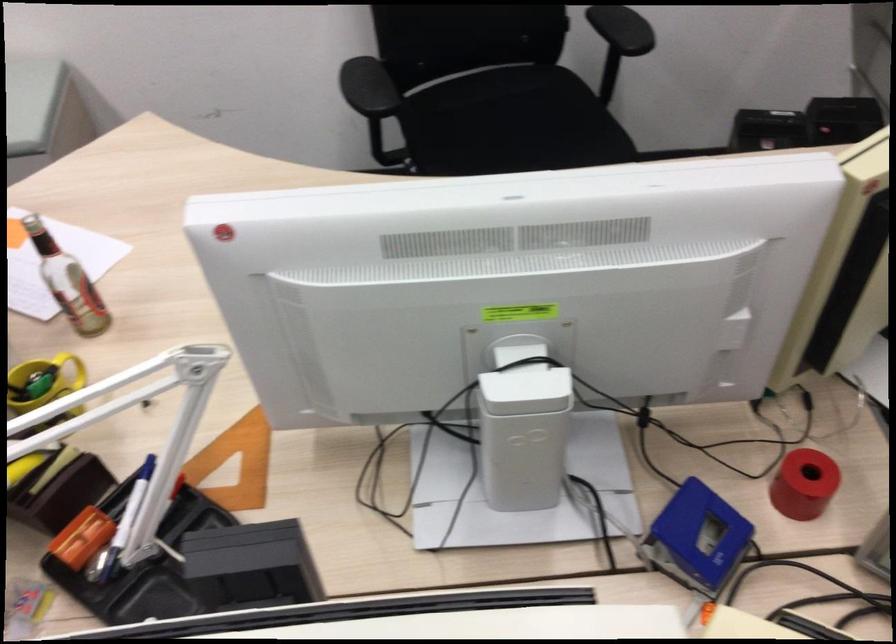
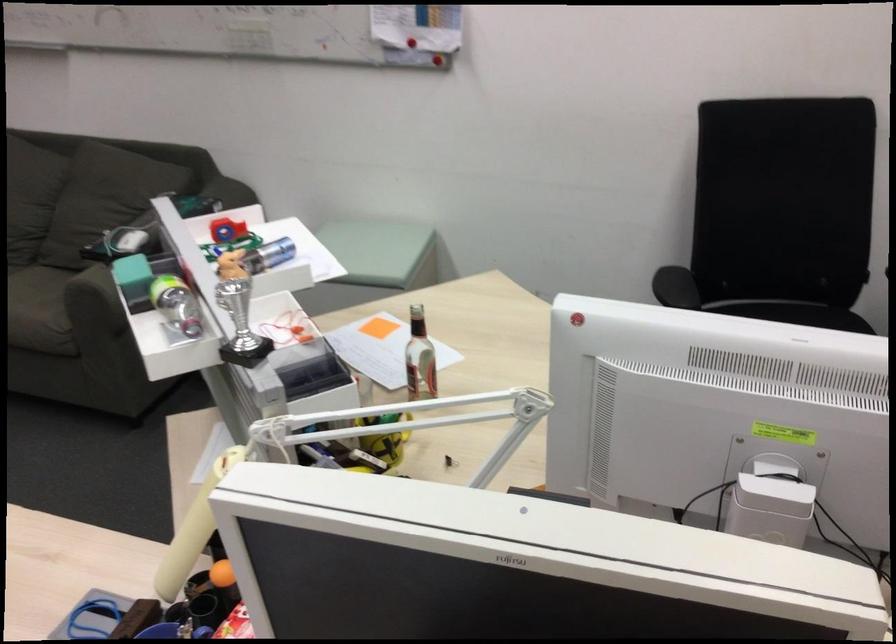
Question: The images are taken continuously from a first-person perspective. In which direction is your viewpoint rotating?

Choices:
 (A) Left
 (B) Right
 (C) Up
 (D) Down

Answer: (A)